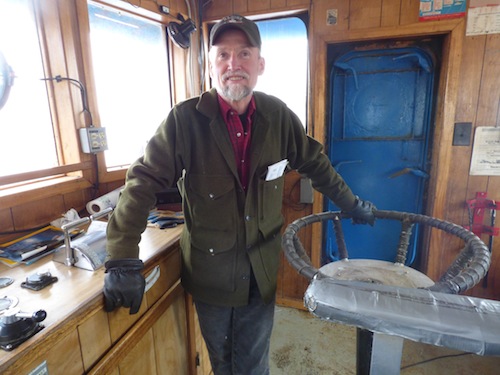
Where is `light switch`? light switch is located at coordinates (461, 136).